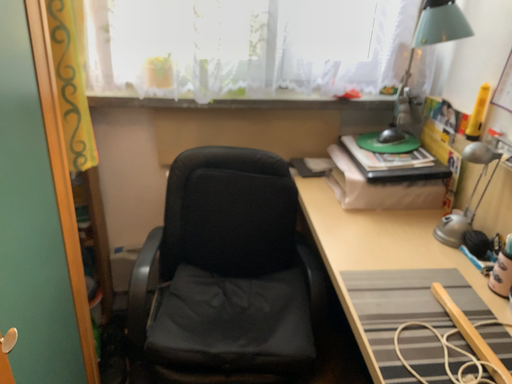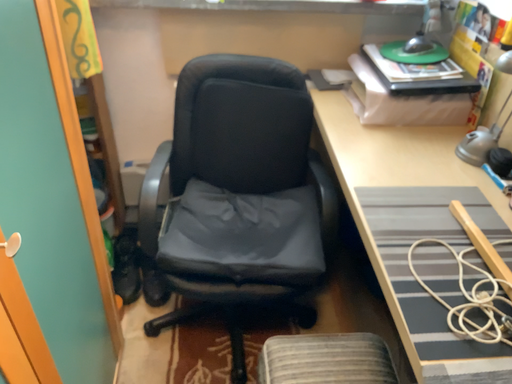
Question: Which way did the camera rotate in the video?

Choices:
 (A) rotated upward
 (B) rotated downward

Answer: (B)